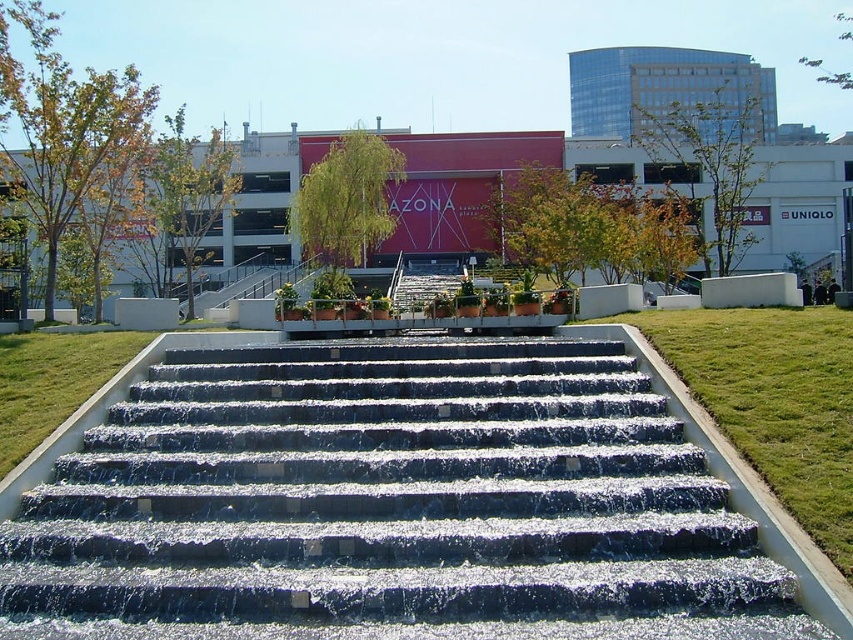
Question: Among these points, which one is nearest to the camera?

Choices:
 (A) pyautogui.click(x=807, y=435)
 (B) pyautogui.click(x=344, y=323)
 (C) pyautogui.click(x=550, y=372)

Answer: (A)

Question: Estimate the real-world distances between objects in this image. Which object is closer to the smooth stone steps at center?

Choices:
 (A) green grass at lower right
 (B) metallic silver balustrade at center

Answer: (A)

Question: Considering the relative positions of smooth stone steps at center and metallic silver balustrade at center in the image provided, where is smooth stone steps at center located with respect to metallic silver balustrade at center?

Choices:
 (A) left
 (B) right

Answer: (B)

Question: Does smooth stone steps at center have a lesser width compared to green grass at lower right?

Choices:
 (A) yes
 (B) no

Answer: (B)

Question: Can you confirm if smooth stone steps at center is wider than metallic silver balustrade at center?

Choices:
 (A) no
 (B) yes

Answer: (B)

Question: Estimate the real-world distances between objects in this image. Which object is farther from the metallic silver balustrade at center?

Choices:
 (A) smooth stone steps at center
 (B) green grass at lower right

Answer: (B)